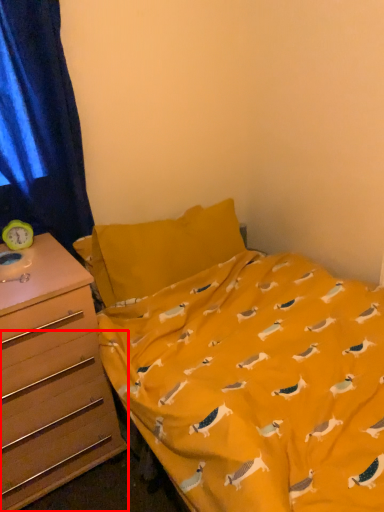
Question: From the image's perspective, what is the correct spatial relationship of drawer (annotated by the red box) in relation to curtain?

Choices:
 (A) above
 (B) below

Answer: (B)